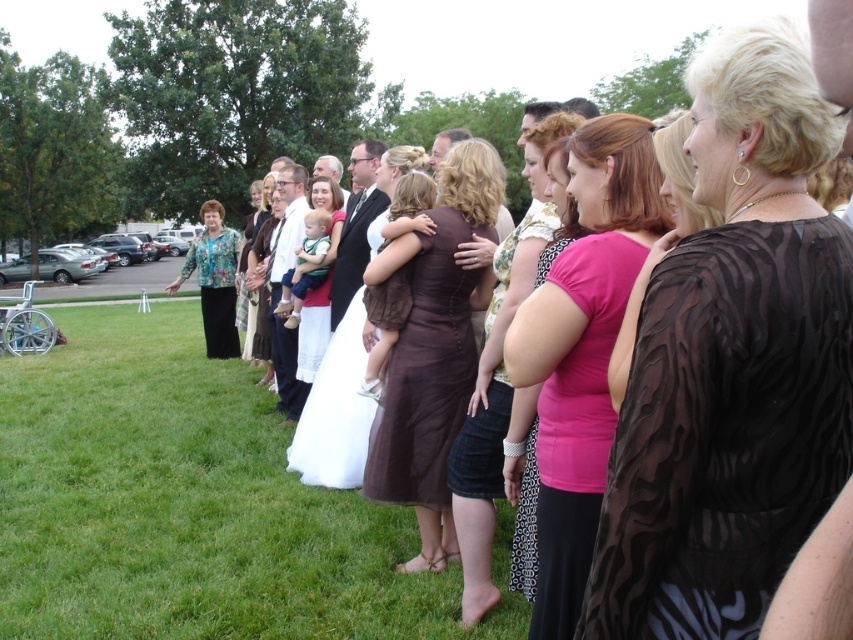
You are a photographer at a wedding who needs to capture a closeup of the brown sheer dress at center without the green grass at lower left being visible. Is this possible given their sizes?

The green grass at lower left has a larger size compared to brown sheer dress at center. Therefore, it might be challenging to capture a closeup of the brown sheer dress at center without the green grass at lower left being visible due to its larger size.

You are planning to sit between the black sheer dress at center and the pink sheer blouse at center. Which side should you choose if you want more space?

You should sit on the side of the black sheer dress at center because it might be wider than the pink sheer blouse at center, providing more space.

From the picture: You are a photographer at a wedding event. You want to capture a photo of the black sheer dress at center and the pink sheer blouse at center. The camera you are using has a minimum focus distance of 20 inches. Will you be able to focus on both subjects clearly?

The black sheer dress at center and pink sheer blouse at center are 20.08 inches apart. Since the minimum focus distance is 20 inches, the subjects are just slightly beyond the required distance, so the camera may struggle to focus on both clearly. It might be advisable to move closer or adjust the camera settings for better focus.